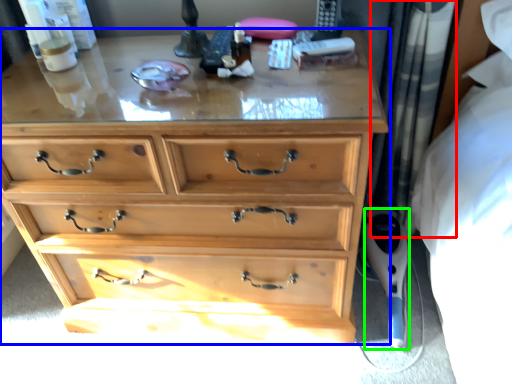
Question: Which is farther away from curtain (highlighted by a red box)? chest of drawers (highlighted by a blue box) or equipment (highlighted by a green box)?

Choices:
 (A) chest of drawers
 (B) equipment

Answer: (A)